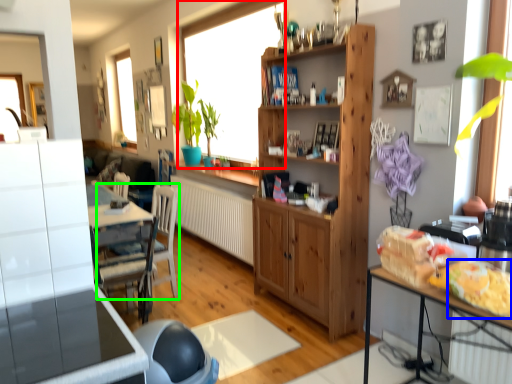
Question: Which object is the farthest from window (highlighted by a red box)? Choose among these: food (highlighted by a blue box) or chair (highlighted by a green box).

Choices:
 (A) food
 (B) chair

Answer: (A)